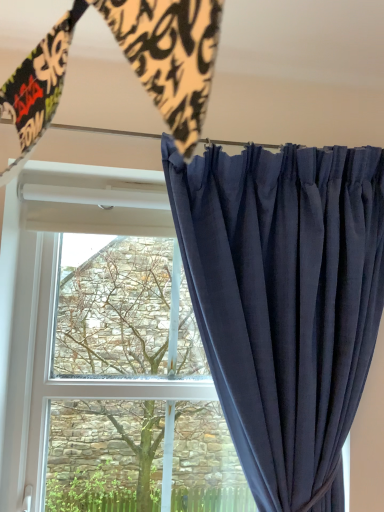
Question: Considering the relative positions of navy blue velvet curtain at right and green leafy tree at center in the image provided, is navy blue velvet curtain at right to the right of green leafy tree at center from the viewer's perspective?

Choices:
 (A) no
 (B) yes

Answer: (B)

Question: From a real-world perspective, is navy blue velvet curtain at right under green leafy tree at center?

Choices:
 (A) yes
 (B) no

Answer: (B)

Question: Does navy blue velvet curtain at right contain green leafy tree at center?

Choices:
 (A) yes
 (B) no

Answer: (B)

Question: From a real-world perspective, is navy blue velvet curtain at right on green leafy tree at center?

Choices:
 (A) no
 (B) yes

Answer: (B)

Question: Is navy blue velvet curtain at right shorter than green leafy tree at center?

Choices:
 (A) yes
 (B) no

Answer: (B)

Question: Can you confirm if navy blue velvet curtain at right is smaller than green leafy tree at center?

Choices:
 (A) no
 (B) yes

Answer: (A)

Question: From the image's perspective, would you say green leafy tree at center is shown under navy blue velvet curtain at right?

Choices:
 (A) no
 (B) yes

Answer: (B)

Question: From a real-world perspective, is green leafy tree at center over navy blue velvet curtain at right?

Choices:
 (A) yes
 (B) no

Answer: (B)

Question: Does green leafy tree at center have a larger size compared to navy blue velvet curtain at right?

Choices:
 (A) yes
 (B) no

Answer: (B)

Question: Is green leafy tree at center taller than navy blue velvet curtain at right?

Choices:
 (A) yes
 (B) no

Answer: (B)

Question: From the image's perspective, does green leafy tree at center appear higher than navy blue velvet curtain at right?

Choices:
 (A) no
 (B) yes

Answer: (A)

Question: Considering the relative sizes of green leafy tree at center and navy blue velvet curtain at right in the image provided, is green leafy tree at center thinner than navy blue velvet curtain at right?

Choices:
 (A) no
 (B) yes

Answer: (B)

Question: Is green leafy tree at center taller or shorter than navy blue velvet curtain at right?

Choices:
 (A) short
 (B) tall

Answer: (A)